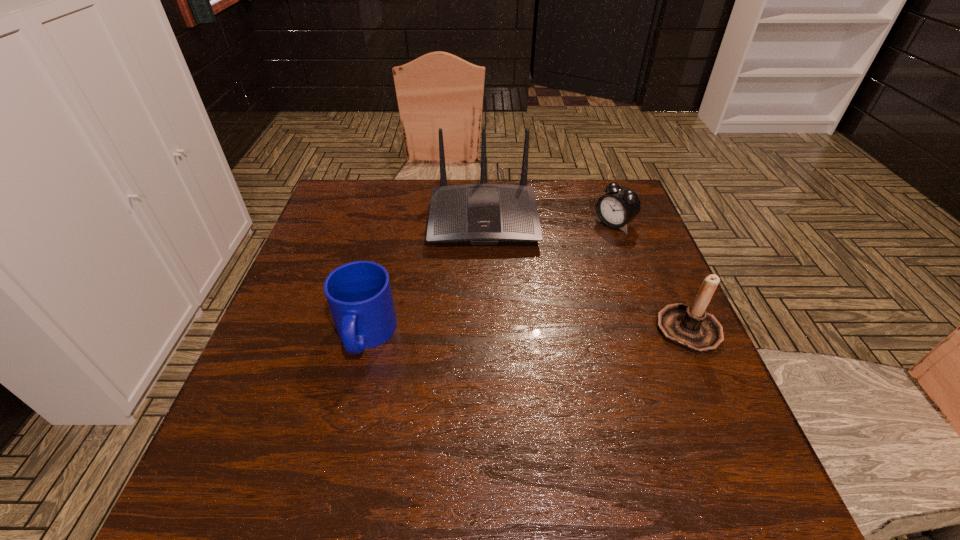
Where is `the leftmost object`? Image resolution: width=960 pixels, height=540 pixels. the leftmost object is located at coordinates (359, 295).

Find the location of a particular element. candle holder is located at coordinates (690, 327).

At what (x,y) coordinates should I click in order to perform the action: click on router. Please return your answer as a coordinate pair (x, y). The width and height of the screenshot is (960, 540). Looking at the image, I should click on (480, 214).

This screenshot has height=540, width=960. What are the coordinates of `the tallest object` in the screenshot? It's located at (480, 214).

The image size is (960, 540). In order to click on alarm clock in this screenshot , I will do `click(620, 205)`.

The width and height of the screenshot is (960, 540). In order to click on vacant space located on the side with the handle of the leftmost object in this screenshot , I will do `click(350, 396)`.

Identify the location of free space located 0.380m on the left of the candle holder. The width and height of the screenshot is (960, 540). (483, 329).

At what (x,y) coordinates should I click in order to perform the action: click on free space located 0.400m on the front-facing side of the third object from right to left. Please return your answer as a coordinate pair (x, y). Looking at the image, I should click on (489, 382).

Where is `free space located 0.070m on the front-facing side of the third object from right to left`? free space located 0.070m on the front-facing side of the third object from right to left is located at coordinates 485,269.

Image resolution: width=960 pixels, height=540 pixels. I want to click on free spot located on the front-facing side of the third object from right to left, so coord(486,286).